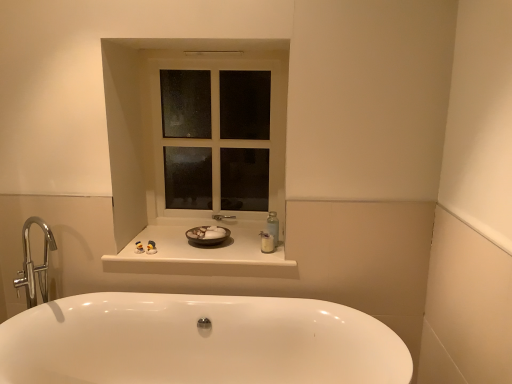
Question: Is translucent plastic bottle at center, the 1th toiletry in the right-to-left sequence, oriented towards white glossy toiletries at center, the 1th toiletry in the left-to-right sequence?

Choices:
 (A) no
 (B) yes

Answer: (A)

Question: Does translucent plastic bottle at center, the 1th toiletry in the right-to-left sequence, have a lesser width compared to white glossy toiletries at center, arranged as the 2th toiletry when viewed from the right?

Choices:
 (A) yes
 (B) no

Answer: (B)

Question: From the image's perspective, is translucent plastic bottle at center, the second toiletry positioned from the left, above white glossy toiletries at center, the 1th toiletry in the left-to-right sequence?

Choices:
 (A) no
 (B) yes

Answer: (B)

Question: Does translucent plastic bottle at center, the 1th toiletry in the right-to-left sequence, have a greater width compared to white glossy toiletries at center, arranged as the 2th toiletry when viewed from the right?

Choices:
 (A) no
 (B) yes

Answer: (B)

Question: Can you confirm if translucent plastic bottle at center, the 1th toiletry in the right-to-left sequence, is shorter than white glossy toiletries at center, the 1th toiletry in the left-to-right sequence?

Choices:
 (A) yes
 (B) no

Answer: (B)

Question: Is the position of translucent plastic bottle at center, the second toiletry positioned from the left, more distant than that of white glossy toiletries at center, arranged as the 2th toiletry when viewed from the right?

Choices:
 (A) yes
 (B) no

Answer: (B)

Question: From a real-world perspective, is brown matte bowl at center located higher than translucent plastic bottle at center, the second toiletry positioned from the left?

Choices:
 (A) yes
 (B) no

Answer: (B)

Question: Considering the relative sizes of brown matte bowl at center and translucent plastic bottle at center, the second toiletry positioned from the left, in the image provided, is brown matte bowl at center shorter than translucent plastic bottle at center, the second toiletry positioned from the left,?

Choices:
 (A) yes
 (B) no

Answer: (A)

Question: From a real-world perspective, is brown matte bowl at center positioned under translucent plastic bottle at center, the 1th toiletry in the right-to-left sequence, based on gravity?

Choices:
 (A) no
 (B) yes

Answer: (B)

Question: Would you say brown matte bowl at center is outside translucent plastic bottle at center, the second toiletry positioned from the left?

Choices:
 (A) no
 (B) yes

Answer: (B)

Question: Is brown matte bowl at center with translucent plastic bottle at center, the second toiletry positioned from the left?

Choices:
 (A) yes
 (B) no

Answer: (B)

Question: Does brown matte bowl at center have a lesser width compared to translucent plastic bottle at center, the second toiletry positioned from the left?

Choices:
 (A) no
 (B) yes

Answer: (A)

Question: Does translucent plastic bottle at center, the second toiletry positioned from the left, have a larger size compared to white glass window at center?

Choices:
 (A) yes
 (B) no

Answer: (B)